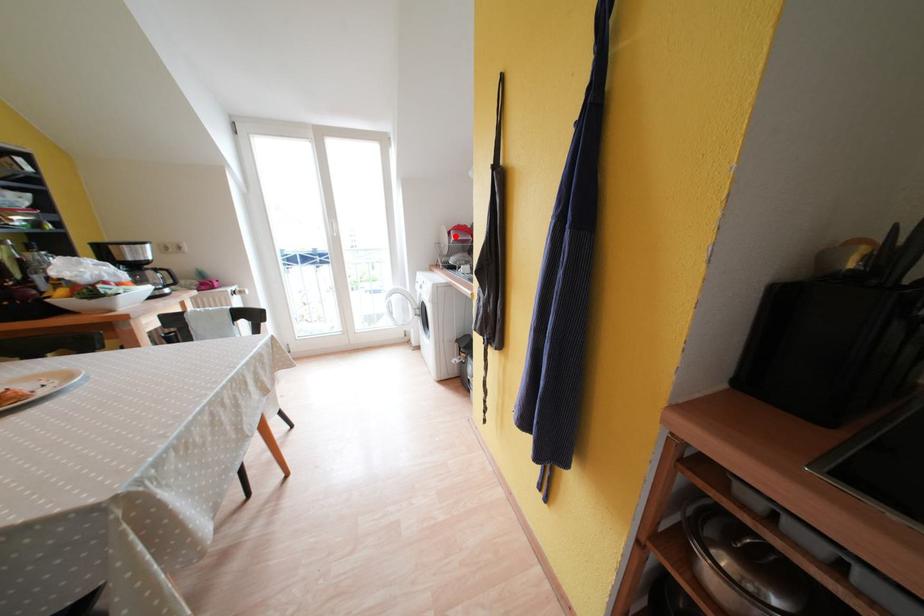
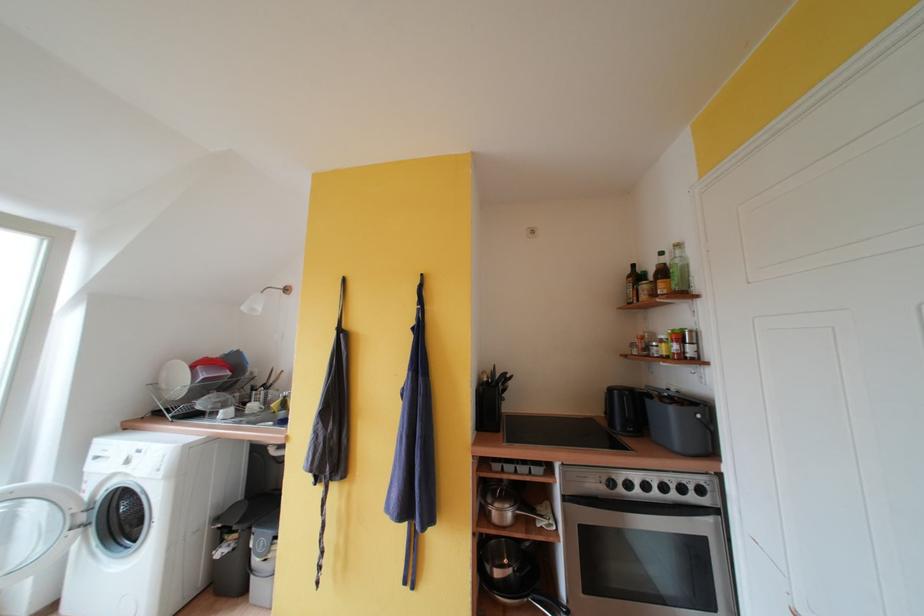
Question: I am providing you with two images of the same scene from different viewpoints. A red point is marked on the first image. Is the red point's position out of view in image 2?

Choices:
 (A) Yes
 (B) No

Answer: (B)